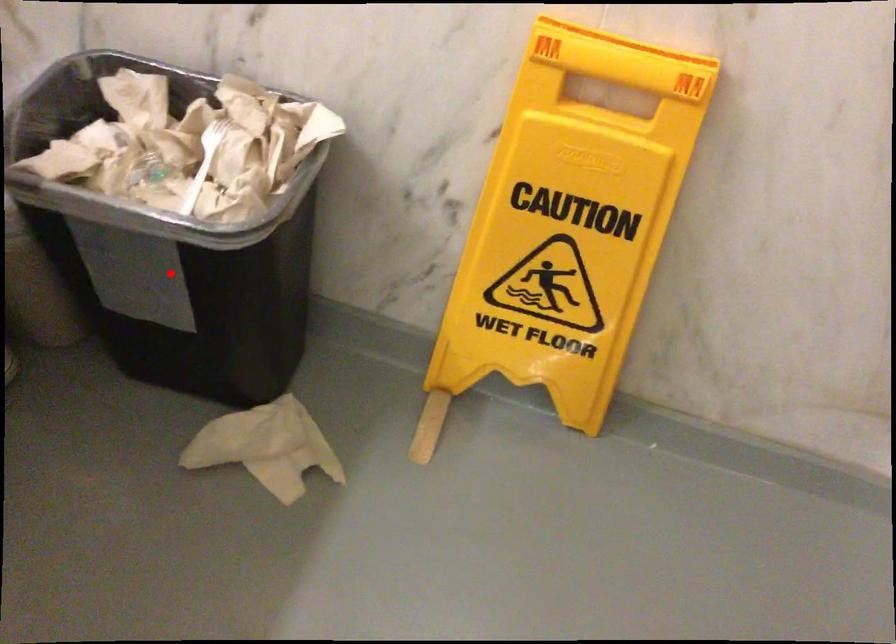
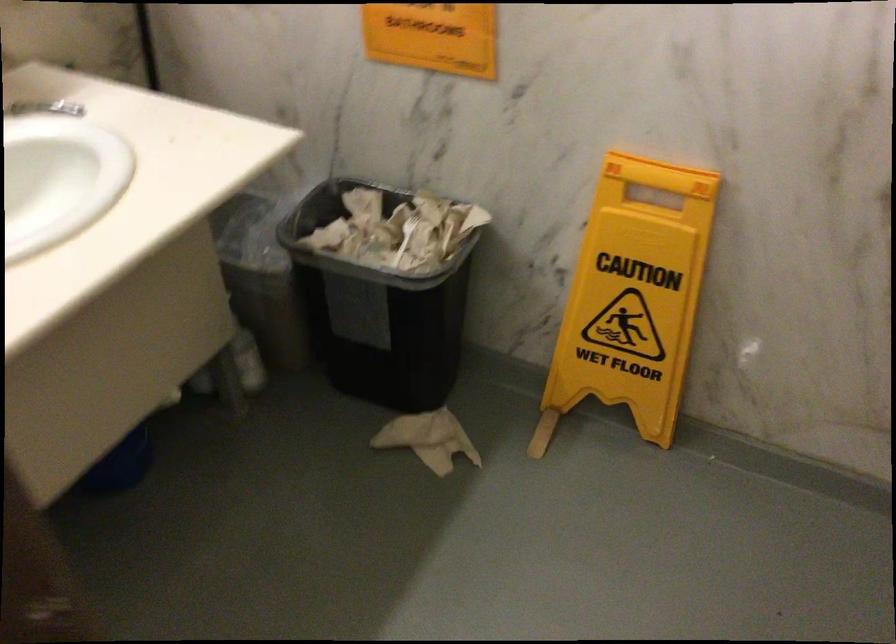
Find the pixel in the second image that matches the highlighted location in the first image.

(376, 310)